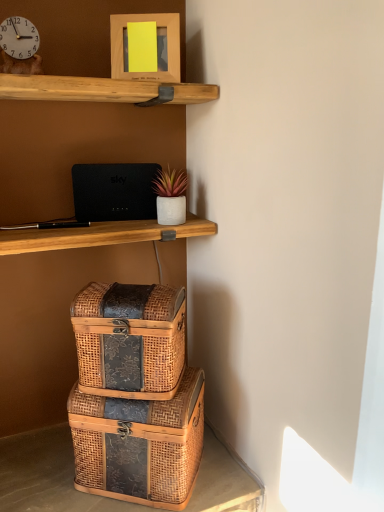
You are a GUI agent. You are given a task and a screenshot of the screen. Output one action in this format:
    pyautogui.click(x=<x>, y=<y>)
    Task: Click on the free space above woven wood box at lower center, which ranks as the 2th box in bottom-to-top order (from a real-world perspective)
    The height and width of the screenshot is (512, 384).
    Given the screenshot: What is the action you would take?
    pyautogui.click(x=130, y=290)